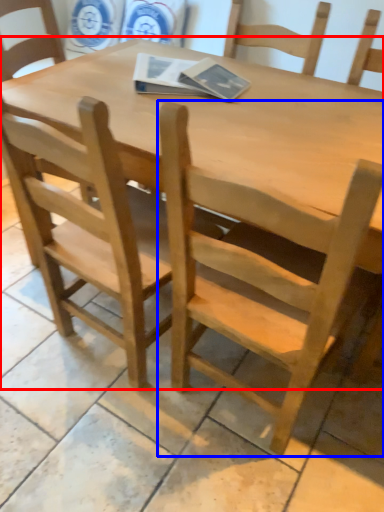
Question: Which point is closer to the camera, table (highlighted by a red box) or chair (highlighted by a blue box)?

Choices:
 (A) table
 (B) chair

Answer: (B)